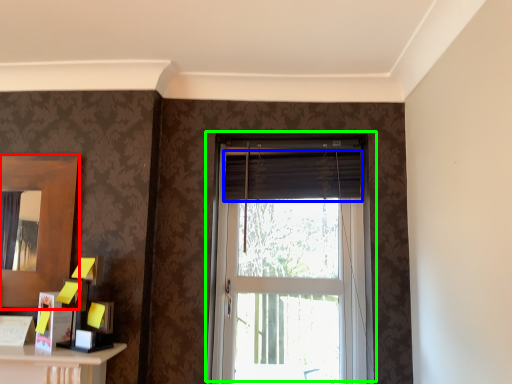
Question: Based on their relative distances, which object is farther from mirror (highlighted by a red box)? Choose from curtain (highlighted by a blue box) and window (highlighted by a green box).

Choices:
 (A) curtain
 (B) window

Answer: (B)